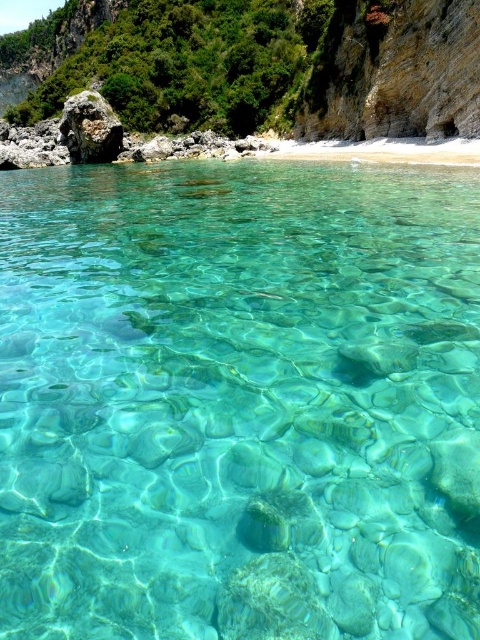
Question: Can you confirm if rustic stone cliff at upper center is smaller than rough textured rock at left?

Choices:
 (A) yes
 (B) no

Answer: (B)

Question: Can you confirm if rustic stone cliff at upper center is thinner than rough textured rock at left?

Choices:
 (A) yes
 (B) no

Answer: (B)

Question: Which point is closer to the camera taking this photo?

Choices:
 (A) (116, 131)
 (B) (72, 44)

Answer: (A)

Question: From the image, what is the correct spatial relationship of rustic stone cliff at upper center in relation to rough textured rock at left?

Choices:
 (A) right
 (B) left

Answer: (B)